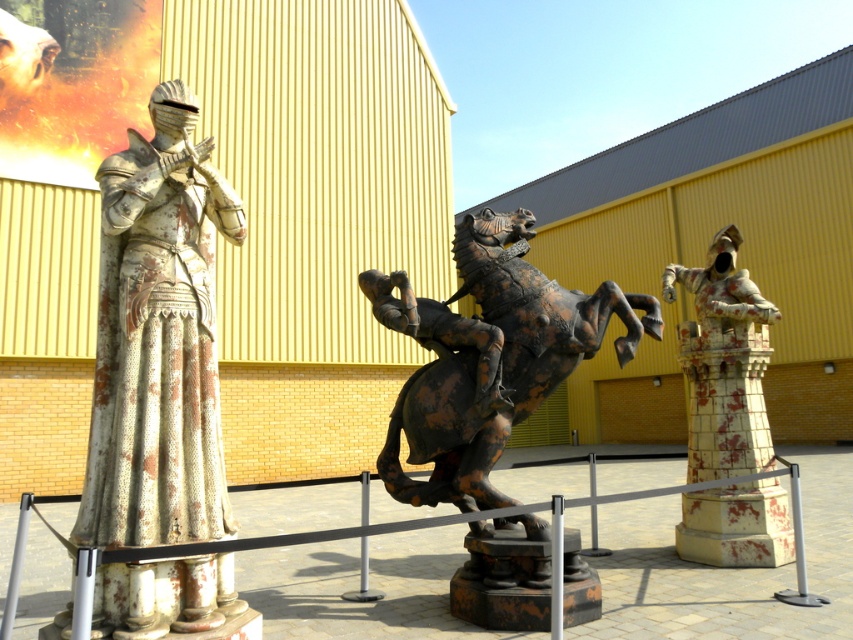
Question: Among these points, which one is nearest to the camera?

Choices:
 (A) (495, 275)
 (B) (106, 634)
 (C) (717, 547)
 (D) (242, 595)

Answer: (B)

Question: Does rusty metal barrier at center appear on the right side of rusty metal horse at center?

Choices:
 (A) yes
 (B) no

Answer: (B)

Question: Is rusty metal horse at center to the right of white tiled tower at right from the viewer's perspective?

Choices:
 (A) yes
 (B) no

Answer: (B)

Question: Does rusty metal horse at center have a smaller size compared to white tiled tower at right?

Choices:
 (A) no
 (B) yes

Answer: (A)

Question: Considering the real-world distances, which object is farthest from the rusty metal barrier at center?

Choices:
 (A) rusty metal horse at center
 (B) white tiled tower at right
 (C) rusty metal knight at left

Answer: (B)

Question: Among these objects, which one is nearest to the camera?

Choices:
 (A) white tiled tower at right
 (B) rusty metal knight at left
 (C) rusty metal horse at center

Answer: (B)